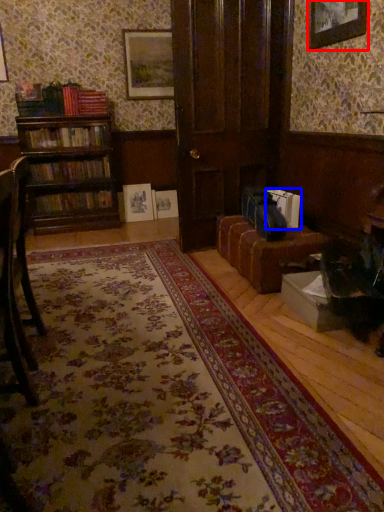
Question: Which object is closer to the camera taking this photo, picture frame (highlighted by a red box) or book (highlighted by a blue box)?

Choices:
 (A) picture frame
 (B) book

Answer: (A)